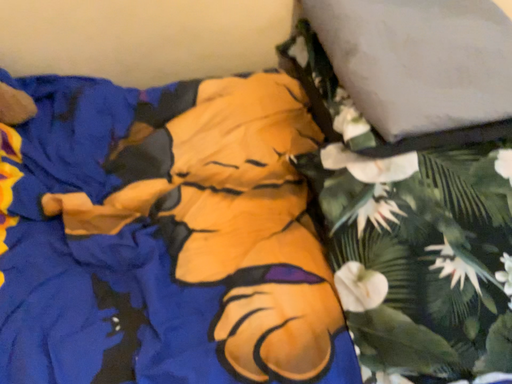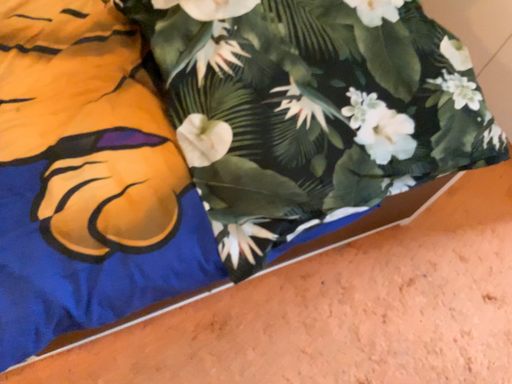
Question: Which way did the camera rotate in the video?

Choices:
 (A) rotated downward
 (B) rotated upward

Answer: (A)